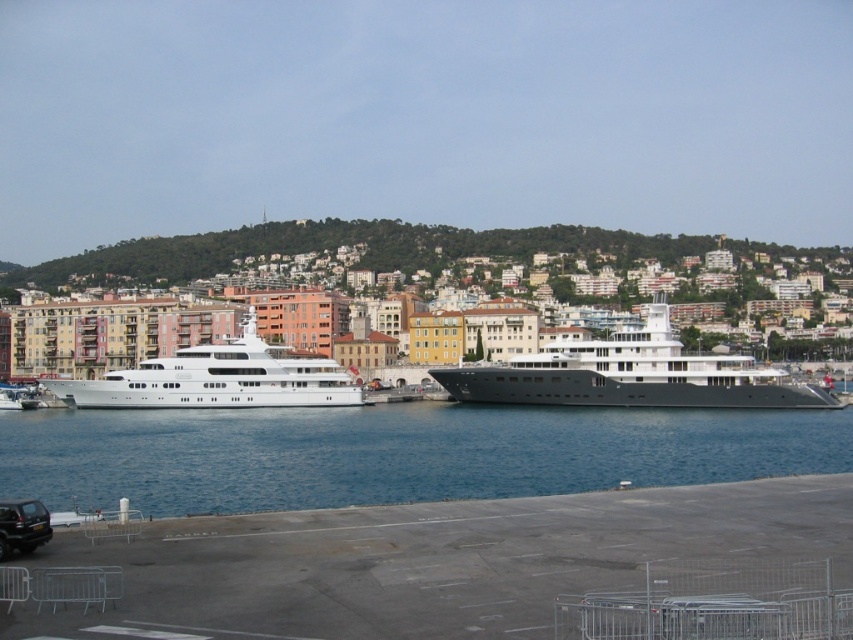
Does white glossy yacht at left appear on the left side of black matte car at lower left?

Yes, white glossy yacht at left is to the left of black matte car at lower left.

Is white glossy yacht at left smaller than black matte car at lower left?

Incorrect, white glossy yacht at left is not smaller in size than black matte car at lower left.

Locate an element on the screen. white glossy yacht at left is located at coordinates coord(219,378).

Between blue water at center and black glossy yacht at center, which one appears on the right side from the viewer's perspective?

black glossy yacht at center is more to the right.

Between blue water at center and black glossy yacht at center, which one is positioned higher?

black glossy yacht at center is higher up.

This screenshot has width=853, height=640. Describe the element at coordinates (393, 452) in the screenshot. I see `blue water at center` at that location.

The height and width of the screenshot is (640, 853). Identify the location of blue water at center. (393, 452).

Which is below, black glossy yacht at center or black matte car at lower left?

black matte car at lower left is lower down.

Is black glossy yacht at center to the left of black matte car at lower left from the viewer's perspective?

No, black glossy yacht at center is not to the left of black matte car at lower left.

I want to click on black glossy yacht at center, so click(631, 376).